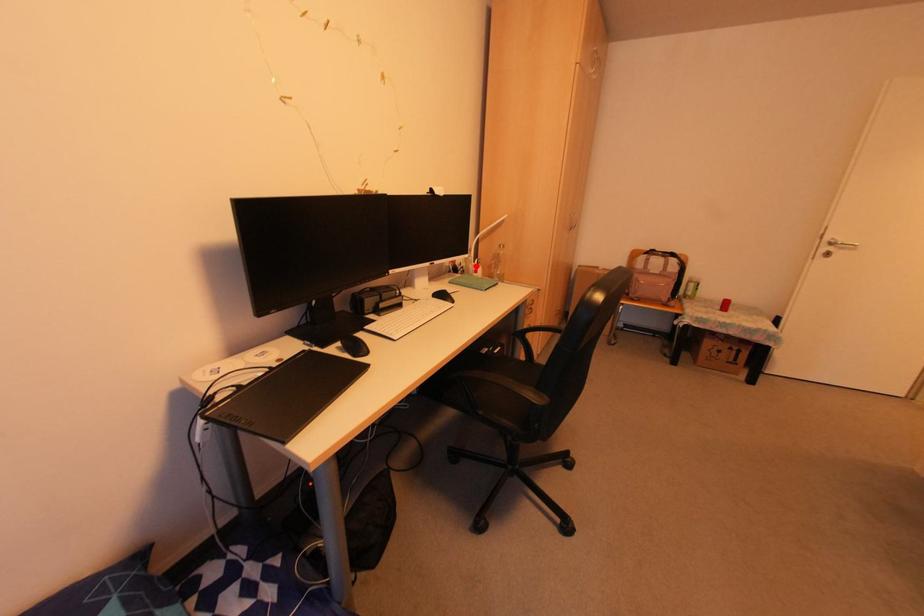
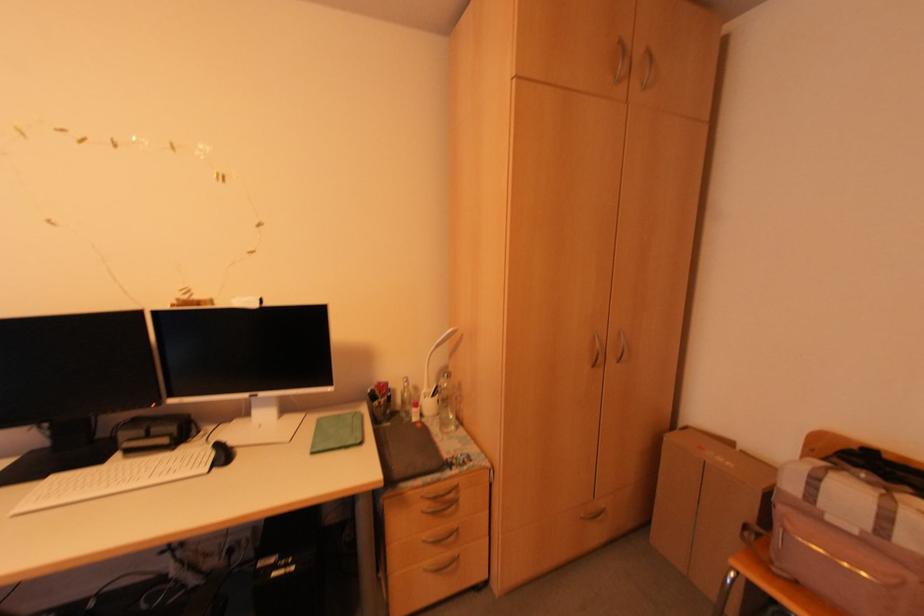
Question: I am providing you with two images of the same scene from different viewpoints. In image1, a red point is highlighted. Considering the same 3D point in image2, which of the following is correct?

Choices:
 (A) It is closer
 (B) It is farther

Answer: (B)